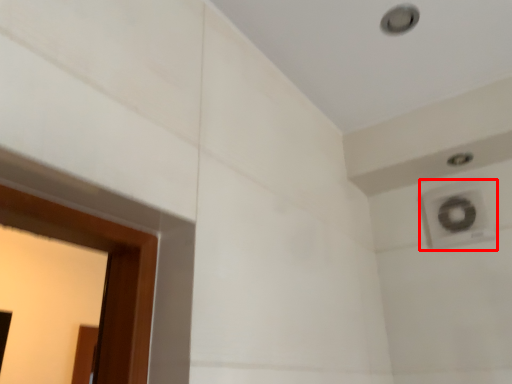
Question: From the image's perspective, where is air conditioning (annotated by the red box) located relative to hole?

Choices:
 (A) below
 (B) above

Answer: (A)